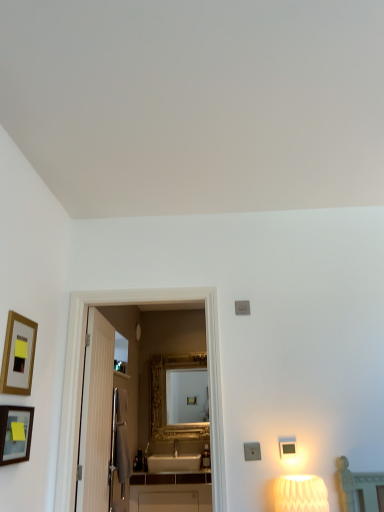
Question: From the image's perspective, is white textured lampshade at lower right located above or below gold-framed picture at left, positioned as the 1th picture frame in top-to-bottom order?

Choices:
 (A) below
 (B) above

Answer: (A)

Question: In terms of size, does white textured lampshade at lower right appear bigger or smaller than gold-framed picture at left, positioned as the 1th picture frame in top-to-bottom order?

Choices:
 (A) big
 (B) small

Answer: (A)

Question: Estimate the real-world distances between objects in this image. Which object is farther from the white glossy cabinet at center?

Choices:
 (A) matte gold picture frame at left, which ranks as the 1th picture frame in bottom-to-top order
 (B) gold ornate mirror at center
 (C) gold-framed picture at left, which ranks as the second picture frame in bottom-to-top order
 (D) white textured lampshade at lower right

Answer: (C)

Question: Which of these objects is positioned closest to the gold-framed picture at left, which ranks as the second picture frame in bottom-to-top order?

Choices:
 (A) white textured lampshade at lower right
 (B) white glossy cabinet at center
 (C) matte gold picture frame at left, which ranks as the 1th picture frame in bottom-to-top order
 (D) gold ornate mirror at center

Answer: (C)